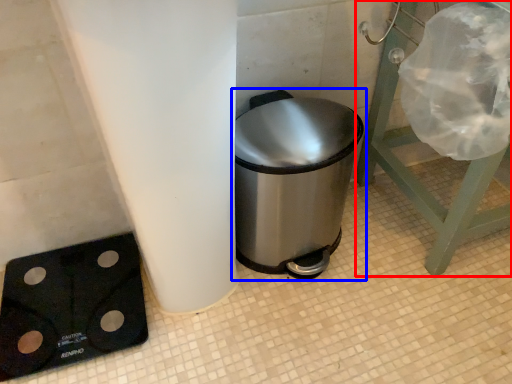
Question: Among these objects, which one is nearest to the camera, furniture (highlighted by a red box) or waste container (highlighted by a blue box)?

Choices:
 (A) furniture
 (B) waste container

Answer: (A)